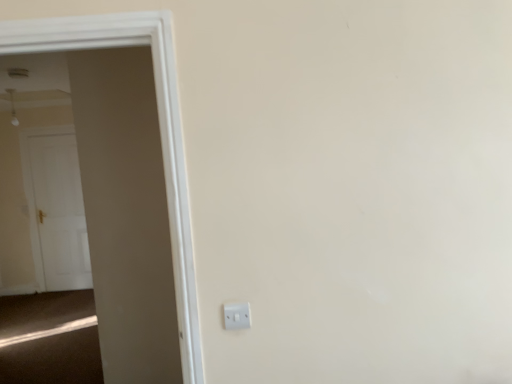
Question: Based on their positions, is white wooden door at left, which appears as the 1th door when viewed from the front, located to the left or right of white plastic electric outlet at lower center?

Choices:
 (A) left
 (B) right

Answer: (A)

Question: Considering the positions of point (11, 44) and point (224, 311), is point (11, 44) closer or farther from the camera than point (224, 311)?

Choices:
 (A) farther
 (B) closer

Answer: (B)

Question: Which is farther from the white wooden door at left, which appears as the 1th door when viewed from the front?

Choices:
 (A) white plastic electric outlet at lower center
 (B) white glossy door at left, placed as the first door when sorted from left to right

Answer: (B)

Question: Considering the real-world distances, which object is closest to the white plastic electric outlet at lower center?

Choices:
 (A) white glossy door at left, placed as the first door when sorted from left to right
 (B) white wooden door at left, which is the 2th door in back-to-front order

Answer: (B)